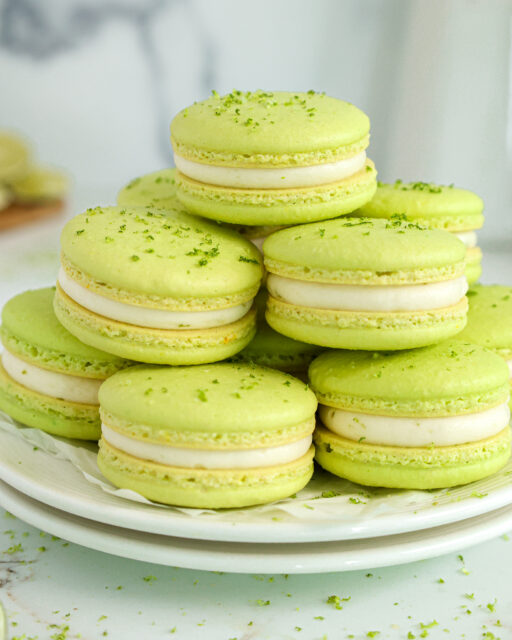
Where is `table`? The height and width of the screenshot is (640, 512). table is located at coordinates (298, 625).